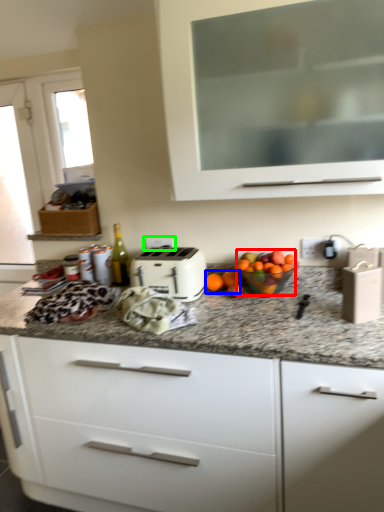
Question: Which is nearer to the fruit (highlighted by a red box)? citrus fruit (highlighted by a blue box) or electric outlet (highlighted by a green box).

Choices:
 (A) citrus fruit
 (B) electric outlet

Answer: (A)